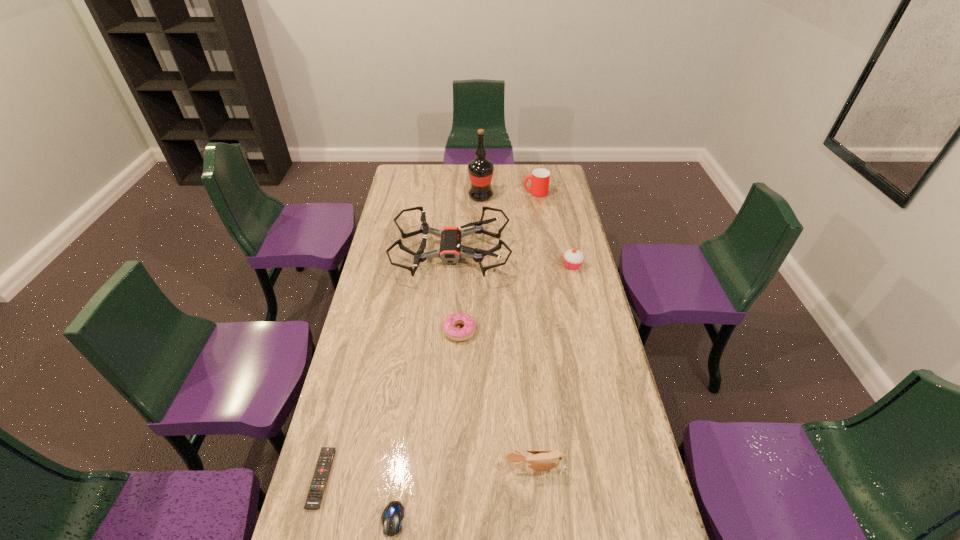
Find the location of a particular element. vacant space located 0.100m on the back of the wine bottle is located at coordinates (481, 179).

Find the location of a particular element. The image size is (960, 540). vacant space situated on the side of the cup with the handle is located at coordinates (499, 193).

The width and height of the screenshot is (960, 540). Identify the location of free location located 0.270m on the side of the cup with the handle. (470, 193).

What are the coordinates of `vacant space located on the side of the cup with the handle` in the screenshot? It's located at (456, 193).

The height and width of the screenshot is (540, 960). What are the coordinates of `vacant point located 0.200m with the camera facing forward on the drone` in the screenshot? It's located at (557, 254).

Locate an element on the screen. Image resolution: width=960 pixels, height=540 pixels. free location located 0.360m on the back of the cupcake is located at coordinates (560, 210).

Identify the location of vacant region located 0.080m at the beak of the bird. The image size is (960, 540). (540, 509).

This screenshot has width=960, height=540. Identify the location of free space located 0.380m on the front of the fifth farthest object. (455, 449).

Find the location of a particular element. free spot located 0.360m on the right of the shortest object is located at coordinates (462, 478).

What are the coordinates of `object that is at the far edge` in the screenshot? It's located at (540, 178).